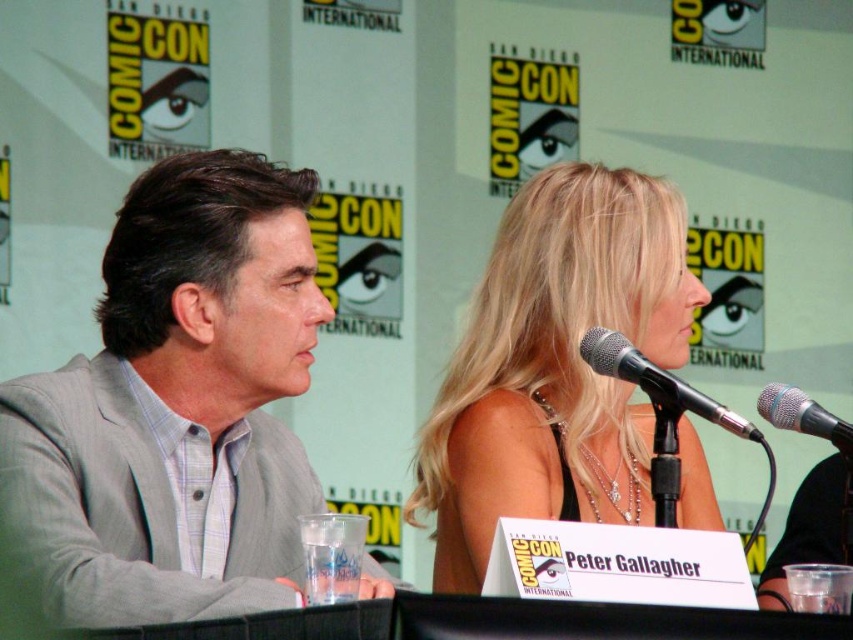
You are a GUI agent. You are given a task and a screenshot of the screen. Output one action in this format:
    pyautogui.click(x=<x>, y=<y>)
    Task: Click on the gray fabric suit at left
    The image size is (853, 640).
    Given the screenshot: What is the action you would take?
    pyautogui.click(x=177, y=406)

Does gray fabric suit at left appear under blonde hair at center?

No, gray fabric suit at left is not below blonde hair at center.

Between point (113, 403) and point (442, 451), which one is positioned behind?

Point (442, 451)

This screenshot has width=853, height=640. Find the location of `gray fabric suit at left`. gray fabric suit at left is located at coordinates (177, 406).

Does point (20, 458) come farther from viewer compared to point (608, 330)?

No, it is not.

Is gray fabric suit at left taller than black metallic microphone at upper center?

Correct, gray fabric suit at left is much taller as black metallic microphone at upper center.

Who is more forward, (207, 364) or (587, 339)?

Point (587, 339) is in front.

At what (x,y) coordinates should I click in order to perform the action: click on gray fabric suit at left. Please return your answer as a coordinate pair (x, y). Looking at the image, I should click on (177, 406).

Which of these two, black metallic microphone at upper center or silver metallic microphone at right, stands shorter?

silver metallic microphone at right

Is point (621, 372) closer to viewer compared to point (796, 392)?

Yes, point (621, 372) is in front of point (796, 392).

Does point (595, 326) lie behind point (839, 445)?

Yes, it is behind point (839, 445).

At what (x,y) coordinates should I click in order to perform the action: click on black metallic microphone at upper center. Please return your answer as a coordinate pair (x, y). This screenshot has width=853, height=640. Looking at the image, I should click on (654, 378).